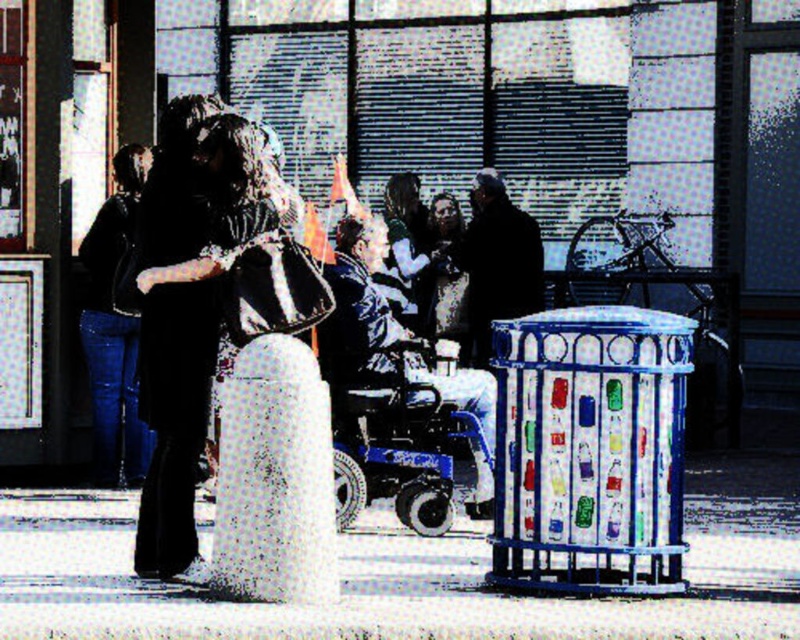
Looking at this image, which of these two, white concrete pavement at lower center or denim jacket at left, stands shorter?

With less height is white concrete pavement at lower center.

Between white concrete pavement at lower center and denim jacket at left, which one appears on the left side from the viewer's perspective?

Positioned to the left is denim jacket at left.

Is point (374, 586) behind point (108, 337)?

That is False.

At what (x,y) coordinates should I click in order to perform the action: click on white concrete pavement at lower center. Please return your answer as a coordinate pair (x, y). The image size is (800, 640). Looking at the image, I should click on (409, 576).

Between point (766, 604) and point (472, 291), which one is positioned in front?

Point (766, 604) is more forward.

In the scene shown: Can you confirm if white concrete pavement at lower center is thinner than dark brown leather jacket at center?

No.

Who is more distant from viewer, (705, 477) or (490, 268)?

Point (490, 268)

This screenshot has width=800, height=640. In order to click on white concrete pavement at lower center in this screenshot , I will do `click(409, 576)`.

Can you confirm if white concrete pavement at lower center is positioned to the right of matte black dress at center?

No, white concrete pavement at lower center is not to the right of matte black dress at center.

Is point (202, 625) positioned in front of point (420, 212)?

Yes, it is.

Where is `white concrete pavement at lower center`? The image size is (800, 640). white concrete pavement at lower center is located at coordinates (409, 576).